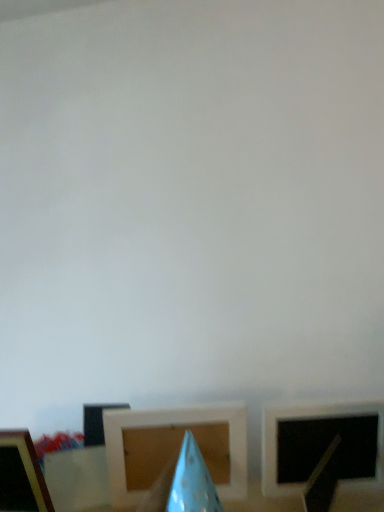
Question: Does wooden picture frame at lower left, the first picture frame in the left-to-right sequence, have a greater width compared to blue paper cone at center?

Choices:
 (A) yes
 (B) no

Answer: (A)

Question: From the image's perspective, does wooden picture frame at lower left, the 3th picture frame from the right, appear higher than blue paper cone at center?

Choices:
 (A) yes
 (B) no

Answer: (B)

Question: Could you tell me if wooden picture frame at lower left, the 3th picture frame from the right, is turned towards blue paper cone at center?

Choices:
 (A) no
 (B) yes

Answer: (A)

Question: From a real-world perspective, is wooden picture frame at lower left, the first picture frame in the left-to-right sequence, physically below blue paper cone at center?

Choices:
 (A) yes
 (B) no

Answer: (B)

Question: Is wooden picture frame at lower left, the 3th picture frame from the right, closer to the viewer compared to blue paper cone at center?

Choices:
 (A) no
 (B) yes

Answer: (A)

Question: Is wooden picture frame at lower left, the first picture frame in the left-to-right sequence, located outside blue paper cone at center?

Choices:
 (A) yes
 (B) no

Answer: (A)

Question: Does matte white picture frame at right, which is the first picture frame from right to left, have a lesser width compared to blue paper cone at center?

Choices:
 (A) yes
 (B) no

Answer: (B)

Question: Does matte white picture frame at right, which is counted as the 3th picture frame, starting from the left, have a greater height compared to blue paper cone at center?

Choices:
 (A) yes
 (B) no

Answer: (A)

Question: Does matte white picture frame at right, which is the first picture frame from right to left, touch blue paper cone at center?

Choices:
 (A) yes
 (B) no

Answer: (B)

Question: Can you confirm if matte white picture frame at right, which is counted as the 3th picture frame, starting from the left, is positioned to the right of blue paper cone at center?

Choices:
 (A) no
 (B) yes

Answer: (B)

Question: Could you tell me if matte white picture frame at right, which is the first picture frame from right to left, is turned towards blue paper cone at center?

Choices:
 (A) no
 (B) yes

Answer: (A)

Question: Is matte white picture frame at right, which is the first picture frame from right to left, far from blue paper cone at center?

Choices:
 (A) yes
 (B) no

Answer: (B)

Question: From a real-world perspective, is wooden at center, acting as the second picture frame starting from the left, physically above wooden picture frame at lower left, the 3th picture frame from the right?

Choices:
 (A) no
 (B) yes

Answer: (A)